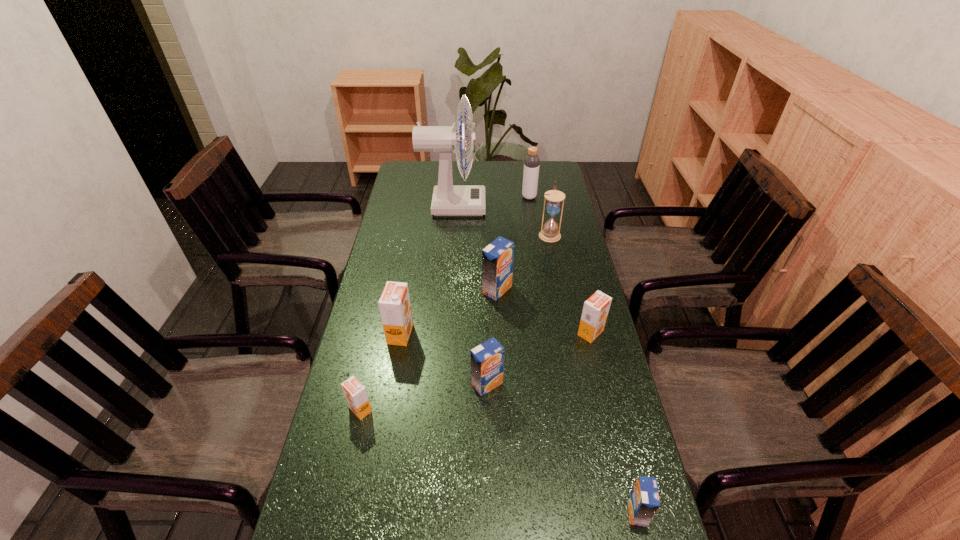
Locate an element on the screen. The image size is (960, 540). free spot between the rightmost orange orange juice and the smallest blue orange_juice is located at coordinates (613, 423).

Identify which object is the fifth closest to the hourglass. Please provide its 2D coordinates. Your answer should be formatted as a tuple, i.e. [(x, y)], where the tuple contains the x and y coordinates of a point satisfying the conditions above.

[(394, 304)]

Select which object is the sixth closest to the fan. Please provide its 2D coordinates. Your answer should be formatted as a tuple, i.e. [(x, y)], where the tuple contains the x and y coordinates of a point satisfying the conditions above.

[(487, 359)]

Image resolution: width=960 pixels, height=540 pixels. I want to click on orange juice that stands as the second closest to the blue fan, so click(394, 304).

At what (x,y) coordinates should I click in order to perform the action: click on orange juice that is the closest to the white hourglass. Please return your answer as a coordinate pair (x, y). Looking at the image, I should click on (497, 258).

Locate which blue orange_juice is the second closest to the farthest orange juice. Please provide its 2D coordinates. Your answer should be formatted as a tuple, i.e. [(x, y)], where the tuple contains the x and y coordinates of a point satisfying the conditions above.

[(643, 501)]

Identify which blue orange_juice is the third closest to the fan. Please provide its 2D coordinates. Your answer should be formatted as a tuple, i.e. [(x, y)], where the tuple contains the x and y coordinates of a point satisfying the conditions above.

[(643, 501)]

Where is `orange orange juice that is the closest one to the fifth farthest orange juice`? Image resolution: width=960 pixels, height=540 pixels. orange orange juice that is the closest one to the fifth farthest orange juice is located at coordinates (394, 304).

Locate which orange orange juice is the closest to the second orange juice from left to right. Please provide its 2D coordinates. Your answer should be formatted as a tuple, i.e. [(x, y)], where the tuple contains the x and y coordinates of a point satisfying the conditions above.

[(355, 393)]

Where is `vacant area in the image that satisfies the following two spatial constraints: 1. on the front-facing side of the second smallest blue orange_juice; 2. on the right side of the blue fan`? Image resolution: width=960 pixels, height=540 pixels. vacant area in the image that satisfies the following two spatial constraints: 1. on the front-facing side of the second smallest blue orange_juice; 2. on the right side of the blue fan is located at coordinates (439, 384).